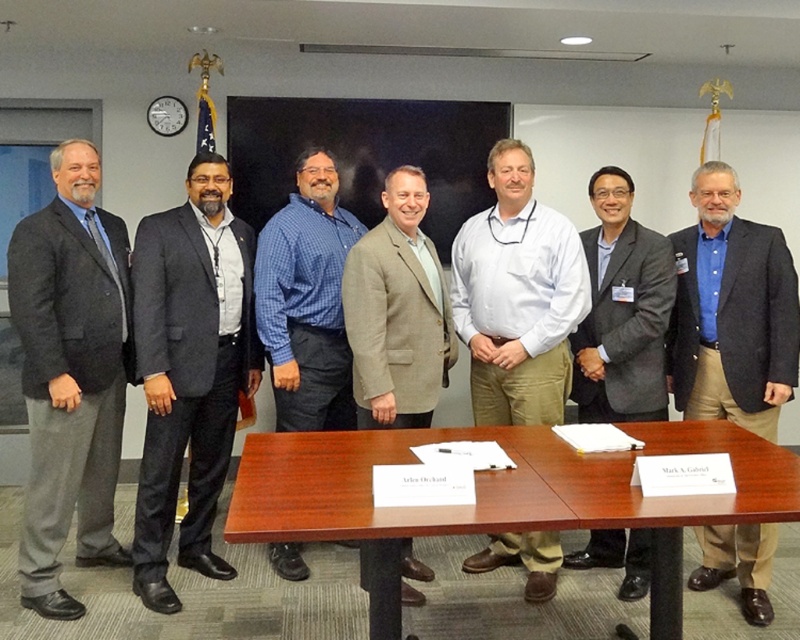
You are a photographer taking a photo of the group at the conference table. You need to ensure that both the dark gray suit at center and the white cotton shirt at center are clearly visible in the frame. Which one should you focus on to make sure it appears taller in the photo?

You should focus on the dark gray suit at center because it is taller than the white cotton shirt at center.

You are a photographer standing in front of the conference table. You need to capture a photo that includes both the brown leather shoes at center and the white cotton shirt at center. Based on their positions, which object should you adjust your camera to focus on first to ensure both are in frame?

The brown leather shoes at center are to the right of the white cotton shirt at center, so you should focus on the white cotton shirt at center first to ensure both are captured in the frame.